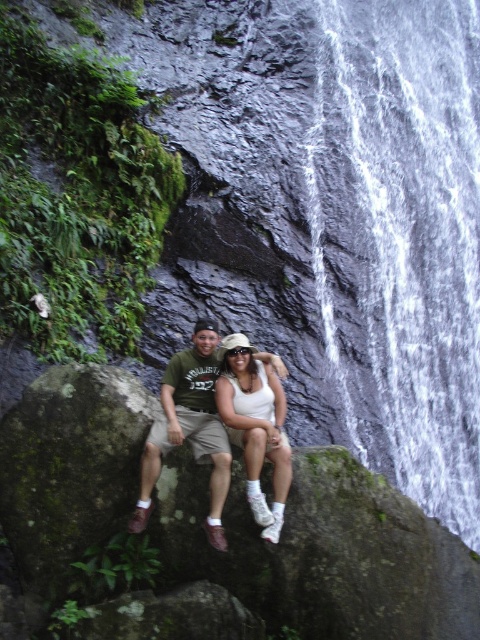
Question: Is matte khaki shorts at center above white matte tank top at center?

Choices:
 (A) yes
 (B) no

Answer: (A)

Question: Can you confirm if matte khaki shorts at center is positioned to the right of white matte tank top at center?

Choices:
 (A) yes
 (B) no

Answer: (B)

Question: Is white frothy water at center wider than white matte tank top at center?

Choices:
 (A) no
 (B) yes

Answer: (B)

Question: Estimate the real-world distances between objects in this image. Which object is farther from the white frothy water at center?

Choices:
 (A) matte khaki shorts at center
 (B) white matte tank top at center

Answer: (A)

Question: Which object is closer to the camera taking this photo?

Choices:
 (A) matte khaki shorts at center
 (B) white matte tank top at center

Answer: (A)

Question: Which point is closer to the camera taking this photo?

Choices:
 (A) (158, 419)
 (B) (279, 474)

Answer: (B)